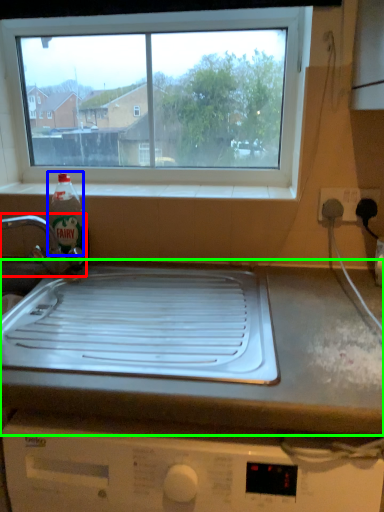
Question: Based on their relative distances, which object is nearer to tap (highlighted by a red box)? Choose from bottle (highlighted by a blue box) and countertop (highlighted by a green box).

Choices:
 (A) bottle
 (B) countertop

Answer: (A)